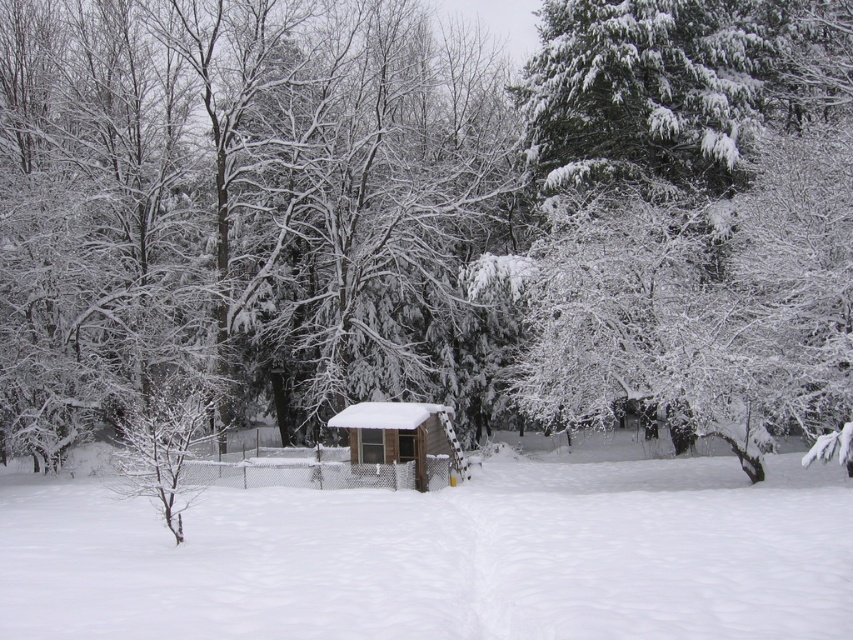
Question: Can you confirm if snow-covered evergreen at upper right is positioned below wooden cabin at center?

Choices:
 (A) yes
 (B) no

Answer: (B)

Question: Which point appears farthest from the camera in this image?

Choices:
 (A) (637, 572)
 (B) (373, 456)

Answer: (B)

Question: Can you confirm if snow-covered evergreen tree at center is smaller than snow-covered evergreen at upper right?

Choices:
 (A) no
 (B) yes

Answer: (A)

Question: Estimate the real-world distances between objects in this image. Which object is closer to the snow-covered evergreen tree at center?

Choices:
 (A) wooden cabin at center
 (B) white fluffy snow at center

Answer: (B)

Question: Among these points, which one is nearest to the camera?

Choices:
 (A) (65, 109)
 (B) (747, 310)

Answer: (B)

Question: Can you confirm if snow-covered evergreen at upper right is bigger than white fluffy snow at center?

Choices:
 (A) yes
 (B) no

Answer: (A)